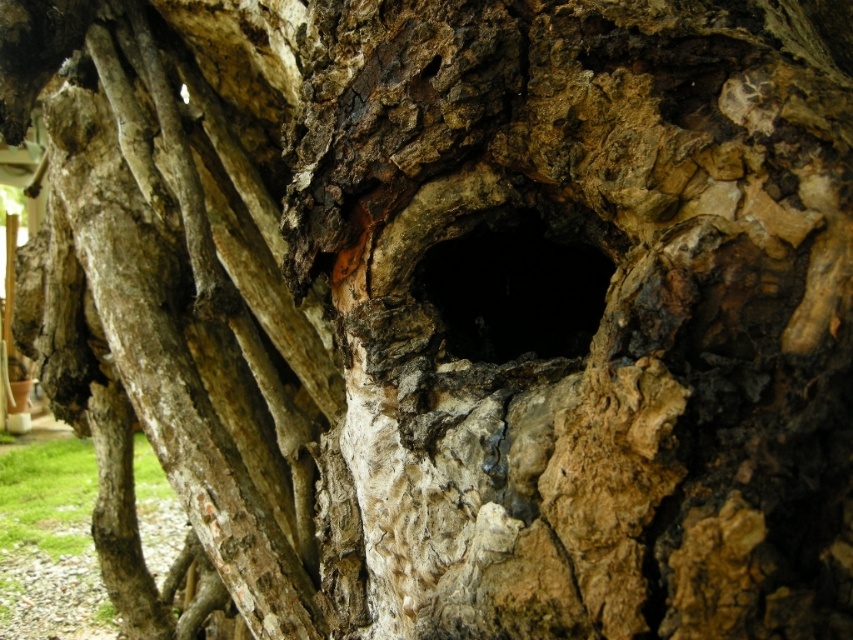
Does rough bark tree trunk at center have a greater width compared to black rough hole at center?

Yes.

Between rough bark tree trunk at center and black rough hole at center, which one is positioned lower?

black rough hole at center is lower down.

Who is more forward, (155,342) or (515,243)?

Point (515,243) is more forward.

The image size is (853, 640). What are the coordinates of `rough bark tree trunk at center` in the screenshot? It's located at (186, 285).